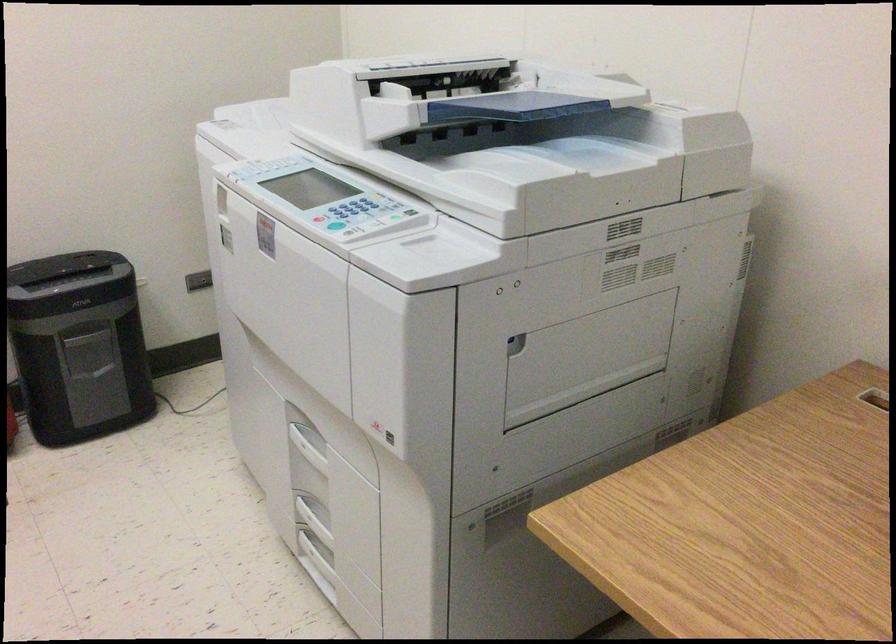
The height and width of the screenshot is (644, 896). What do you see at coordinates (543, 105) in the screenshot? I see `the printer scanner lid` at bounding box center [543, 105].